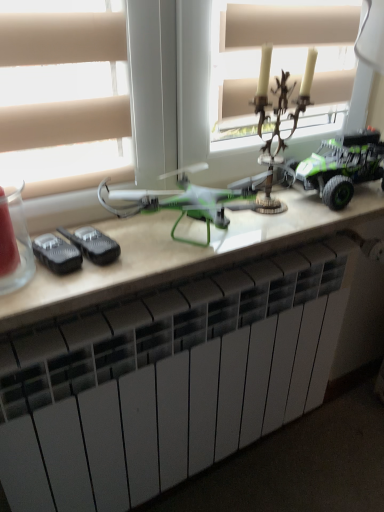
Locate an element on the screen. free space above green plastic drone at center (from a real-world perspective) is located at coordinates (226, 229).